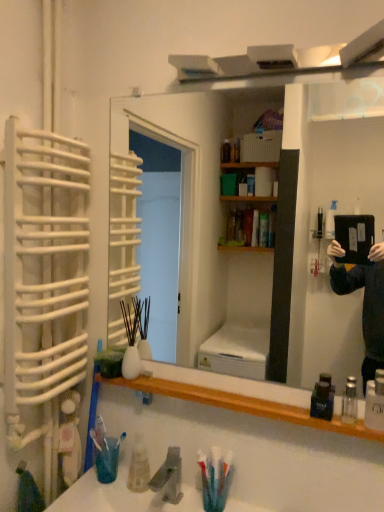
Where is `free space to the left of gray matte faucet at lower center`? The image size is (384, 512). free space to the left of gray matte faucet at lower center is located at coordinates (113, 492).